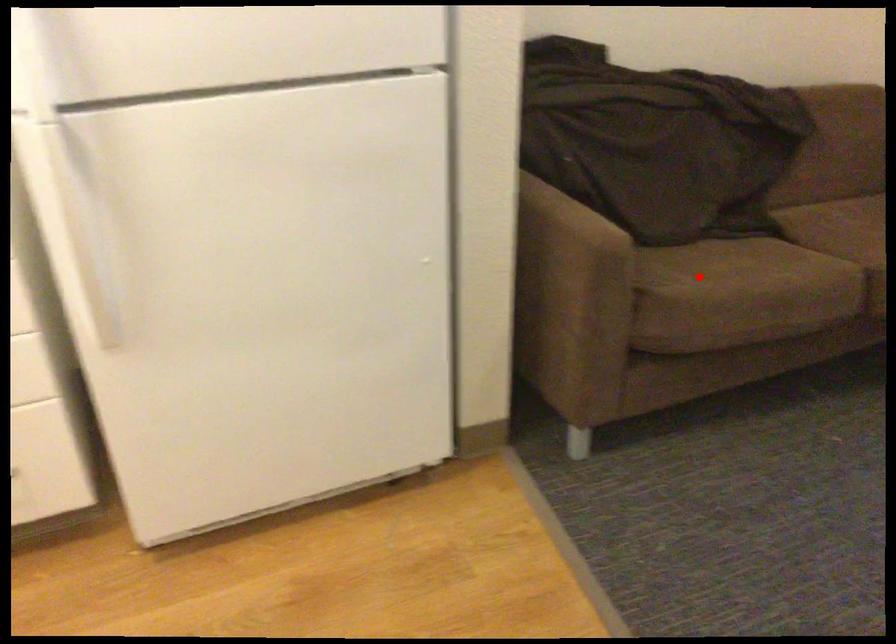
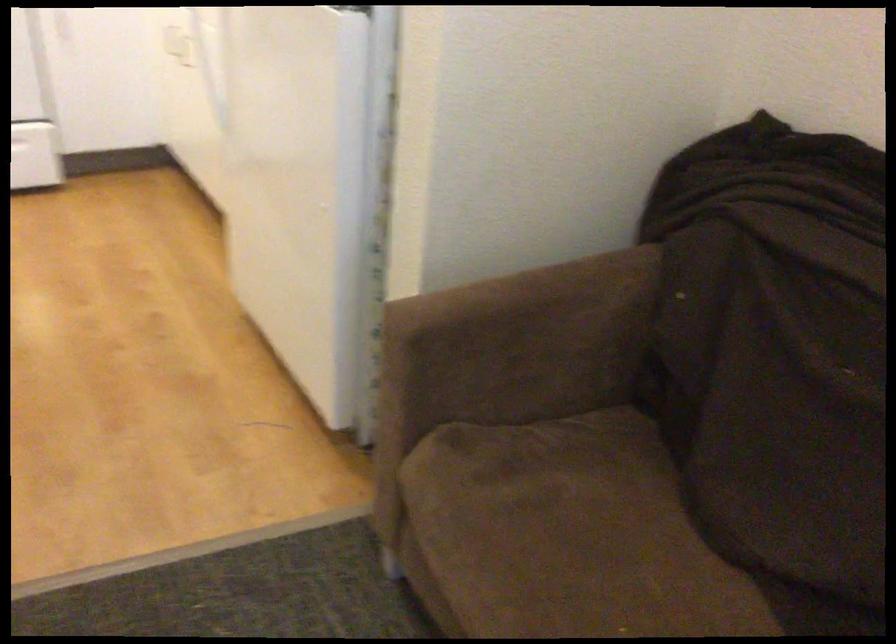
Question: I am providing you with two images of the same scene from different viewpoints. A red point is marked on the first image. Is the red point's position out of view in image 2?

Choices:
 (A) Yes
 (B) No

Answer: (B)